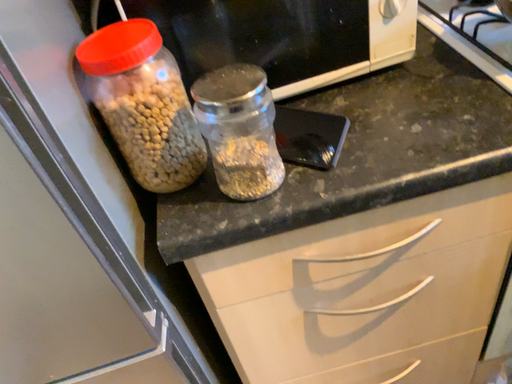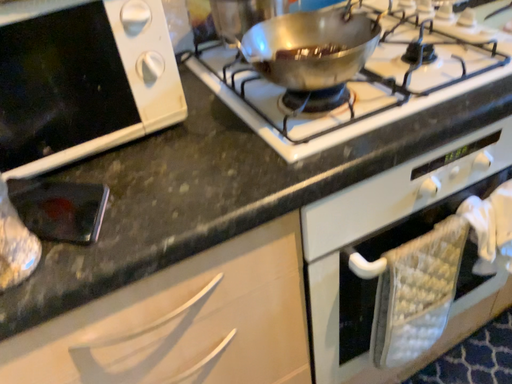
Question: Which way did the camera rotate in the video?

Choices:
 (A) rotated left
 (B) rotated right

Answer: (B)